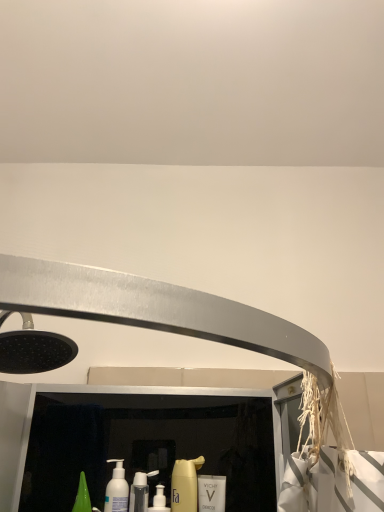
Image resolution: width=384 pixels, height=512 pixels. Describe the element at coordinates (211, 493) in the screenshot. I see `white glossy mouthwash at center, which is the second mouthwash in left-to-right order` at that location.

Find the location of `yellow matte bottle at center, which ranks as the first cleaning product in right-to-left order`. yellow matte bottle at center, which ranks as the first cleaning product in right-to-left order is located at coordinates (185, 484).

Where is `white matte bottle at lower left, the 1th mouthwash from the left`? white matte bottle at lower left, the 1th mouthwash from the left is located at coordinates (117, 489).

Find the location of a particular element. The height and width of the screenshot is (512, 384). white glossy bottle at center, positioned as the second cleaning product in right-to-left order is located at coordinates (140, 490).

Can you confirm if white glossy bottle at center, which is counted as the 1th cleaning product, starting from the left, is taller than white glossy mouthwash at center, which is the second mouthwash in left-to-right order?

No, white glossy bottle at center, which is counted as the 1th cleaning product, starting from the left, is not taller than white glossy mouthwash at center, which is the second mouthwash in left-to-right order.

From the image's perspective, is white glossy bottle at center, which is counted as the 1th cleaning product, starting from the left, positioned above or below white glossy mouthwash at center, which ranks as the 1th mouthwash in right-to-left order?

white glossy bottle at center, which is counted as the 1th cleaning product, starting from the left, is above white glossy mouthwash at center, which ranks as the 1th mouthwash in right-to-left order.

Between white glossy bottle at center, which is counted as the 1th cleaning product, starting from the left, and white glossy mouthwash at center, which ranks as the 1th mouthwash in right-to-left order, which one has larger size?

white glossy bottle at center, which is counted as the 1th cleaning product, starting from the left, is bigger.

Considering the relative sizes of yellow matte bottle at center, which ranks as the first cleaning product in right-to-left order, and white glossy bottle at center, which is counted as the 1th cleaning product, starting from the left, in the image provided, is yellow matte bottle at center, which ranks as the first cleaning product in right-to-left order, bigger than white glossy bottle at center, which is counted as the 1th cleaning product, starting from the left,?

Yes, yellow matte bottle at center, which ranks as the first cleaning product in right-to-left order, is bigger than white glossy bottle at center, which is counted as the 1th cleaning product, starting from the left.

Is yellow matte bottle at center, which ranks as the first cleaning product in right-to-left order, wider than white glossy bottle at center, which is counted as the 1th cleaning product, starting from the left?

In fact, yellow matte bottle at center, which ranks as the first cleaning product in right-to-left order, might be narrower than white glossy bottle at center, which is counted as the 1th cleaning product, starting from the left.

From the image's perspective, is yellow matte bottle at center, which ranks as the second cleaning product in left-to-right order, on white glossy bottle at center, positioned as the second cleaning product in right-to-left order?

Yes.

Consider the image. Do you think yellow matte bottle at center, which ranks as the second cleaning product in left-to-right order, is within white glossy bottle at center, which is counted as the 1th cleaning product, starting from the left, or outside of it?

yellow matte bottle at center, which ranks as the second cleaning product in left-to-right order, exists outside the volume of white glossy bottle at center, which is counted as the 1th cleaning product, starting from the left.

Is yellow matte bottle at center, which ranks as the second cleaning product in left-to-right order, positioned far away from white glossy mouthwash at center, which is the second mouthwash in left-to-right order?

No, yellow matte bottle at center, which ranks as the second cleaning product in left-to-right order, is not far from white glossy mouthwash at center, which is the second mouthwash in left-to-right order.

Does point (193, 488) appear closer or farther from the camera than point (215, 483)?

Point (193, 488) appears to be closer to the viewer than point (215, 483).

Is yellow matte bottle at center, which ranks as the second cleaning product in left-to-right order, spatially inside white glossy mouthwash at center, which ranks as the 1th mouthwash in right-to-left order, or outside of it?

yellow matte bottle at center, which ranks as the second cleaning product in left-to-right order, lies outside white glossy mouthwash at center, which ranks as the 1th mouthwash in right-to-left order.

Visually, is yellow matte bottle at center, which ranks as the second cleaning product in left-to-right order, positioned to the left or to the right of white glossy mouthwash at center, which is the second mouthwash in left-to-right order?

yellow matte bottle at center, which ranks as the second cleaning product in left-to-right order, is to the left of white glossy mouthwash at center, which is the second mouthwash in left-to-right order.

From a real-world perspective, is white glossy mouthwash at center, which is the second mouthwash in left-to-right order, on white glossy bottle at center, which is counted as the 1th cleaning product, starting from the left?

Yes, from a real-world perspective, white glossy mouthwash at center, which is the second mouthwash in left-to-right order, is above white glossy bottle at center, which is counted as the 1th cleaning product, starting from the left.

Can you confirm if white glossy mouthwash at center, which is the second mouthwash in left-to-right order, is bigger than white glossy bottle at center, which is counted as the 1th cleaning product, starting from the left?

Incorrect, white glossy mouthwash at center, which is the second mouthwash in left-to-right order, is not larger than white glossy bottle at center, which is counted as the 1th cleaning product, starting from the left.

Between point (218, 476) and point (139, 504), which one is positioned in front?

Point (139, 504)

Is white matte bottle at lower left, positioned as the second mouthwash in right-to-left order, not close to white glossy mouthwash at center, which is the second mouthwash in left-to-right order?

That's not correct — white matte bottle at lower left, positioned as the second mouthwash in right-to-left order, is a little close to white glossy mouthwash at center, which is the second mouthwash in left-to-right order.

Between white matte bottle at lower left, positioned as the second mouthwash in right-to-left order, and white glossy mouthwash at center, which ranks as the 1th mouthwash in right-to-left order, which one has smaller width?

white glossy mouthwash at center, which ranks as the 1th mouthwash in right-to-left order, is thinner.

Is white matte bottle at lower left, the 1th mouthwash from the left, situated inside white glossy mouthwash at center, which ranks as the 1th mouthwash in right-to-left order, or outside?

white matte bottle at lower left, the 1th mouthwash from the left, is outside white glossy mouthwash at center, which ranks as the 1th mouthwash in right-to-left order.

Can you confirm if white matte bottle at lower left, positioned as the second mouthwash in right-to-left order, is positioned to the left of white glossy mouthwash at center, which is the second mouthwash in left-to-right order?

Yes.

Considering the relative sizes of white glossy mouthwash at center, which is the second mouthwash in left-to-right order, and yellow matte bottle at center, which ranks as the first cleaning product in right-to-left order, in the image provided, is white glossy mouthwash at center, which is the second mouthwash in left-to-right order, taller than yellow matte bottle at center, which ranks as the first cleaning product in right-to-left order,?

No, white glossy mouthwash at center, which is the second mouthwash in left-to-right order, is not taller than yellow matte bottle at center, which ranks as the first cleaning product in right-to-left order.

Is white glossy mouthwash at center, which is the second mouthwash in left-to-right order, smaller than yellow matte bottle at center, which ranks as the second cleaning product in left-to-right order?

Correct, white glossy mouthwash at center, which is the second mouthwash in left-to-right order, occupies less space than yellow matte bottle at center, which ranks as the second cleaning product in left-to-right order.

Which of these two, white glossy mouthwash at center, which is the second mouthwash in left-to-right order, or yellow matte bottle at center, which ranks as the second cleaning product in left-to-right order, is wider?

With larger width is yellow matte bottle at center, which ranks as the second cleaning product in left-to-right order.

Is white glossy mouthwash at center, which ranks as the 1th mouthwash in right-to-left order, with yellow matte bottle at center, which ranks as the second cleaning product in left-to-right order?

Yes, white glossy mouthwash at center, which ranks as the 1th mouthwash in right-to-left order, is right next to yellow matte bottle at center, which ranks as the second cleaning product in left-to-right order, and making contact.

The image size is (384, 512). What are the coordinates of `the 2nd cleaning product below the white matte bottle at lower left, positioned as the second mouthwash in right-to-left order (from the image's perspective)` in the screenshot? It's located at (140, 490).

Is white glossy bottle at center, which is counted as the 1th cleaning product, starting from the left, wider than white matte bottle at lower left, positioned as the second mouthwash in right-to-left order?

Incorrect, the width of white glossy bottle at center, which is counted as the 1th cleaning product, starting from the left, does not surpass that of white matte bottle at lower left, positioned as the second mouthwash in right-to-left order.

Does white glossy bottle at center, which is counted as the 1th cleaning product, starting from the left, have a greater height compared to white matte bottle at lower left, positioned as the second mouthwash in right-to-left order?

No.

The height and width of the screenshot is (512, 384). I want to click on mouthwash on the right of the white glossy bottle at center, which is counted as the 1th cleaning product, starting from the left, so click(211, 493).

You are a GUI agent. You are given a task and a screenshot of the screen. Output one action in this format:
    pyautogui.click(x=<x>, y=<y>)
    Task: Click on the cleaning product that appears in front of the yellow matte bottle at center, which ranks as the second cleaning product in left-to-right order
    This screenshot has width=384, height=512.
    Given the screenshot: What is the action you would take?
    pyautogui.click(x=140, y=490)

Considering their positions, is white matte bottle at lower left, the 1th mouthwash from the left, positioned closer to white glossy bottle at center, positioned as the second cleaning product in right-to-left order, than white glossy mouthwash at center, which ranks as the 1th mouthwash in right-to-left order?

white matte bottle at lower left, the 1th mouthwash from the left, lies closer to white glossy bottle at center, positioned as the second cleaning product in right-to-left order, than the other object.

Based on their spatial positions, is white glossy bottle at center, which is counted as the 1th cleaning product, starting from the left, or white matte bottle at lower left, positioned as the second mouthwash in right-to-left order, closer to white glossy mouthwash at center, which is the second mouthwash in left-to-right order?

white glossy bottle at center, which is counted as the 1th cleaning product, starting from the left, is closer to white glossy mouthwash at center, which is the second mouthwash in left-to-right order.

Looking at the image, which one is located further to white glossy bottle at center, positioned as the second cleaning product in right-to-left order, yellow matte bottle at center, which ranks as the second cleaning product in left-to-right order, or white matte bottle at lower left, the 1th mouthwash from the left?

yellow matte bottle at center, which ranks as the second cleaning product in left-to-right order, lies further to white glossy bottle at center, positioned as the second cleaning product in right-to-left order, than the other object.

Which object lies nearer to the anchor point white glossy bottle at center, which is counted as the 1th cleaning product, starting from the left, white glossy mouthwash at center, which ranks as the 1th mouthwash in right-to-left order, or white matte bottle at lower left, positioned as the second mouthwash in right-to-left order?

Answer: Based on the image, white matte bottle at lower left, positioned as the second mouthwash in right-to-left order, appears to be nearer to white glossy bottle at center, which is counted as the 1th cleaning product, starting from the left.

When comparing their distances from white matte bottle at lower left, the 1th mouthwash from the left, does white glossy mouthwash at center, which is the second mouthwash in left-to-right order, or white glossy bottle at center, which is counted as the 1th cleaning product, starting from the left, seem further?

Among the two, white glossy mouthwash at center, which is the second mouthwash in left-to-right order, is located further to white matte bottle at lower left, the 1th mouthwash from the left.

Looking at the image, which one is located further to white glossy bottle at center, which is counted as the 1th cleaning product, starting from the left, yellow matte bottle at center, which ranks as the first cleaning product in right-to-left order, or white glossy mouthwash at center, which ranks as the 1th mouthwash in right-to-left order?

Among the two, white glossy mouthwash at center, which ranks as the 1th mouthwash in right-to-left order, is located further to white glossy bottle at center, which is counted as the 1th cleaning product, starting from the left.

Based on their spatial positions, is white glossy mouthwash at center, which is the second mouthwash in left-to-right order, or white glossy bottle at center, which is counted as the 1th cleaning product, starting from the left, further from yellow matte bottle at center, which ranks as the first cleaning product in right-to-left order?

The object further to yellow matte bottle at center, which ranks as the first cleaning product in right-to-left order, is white glossy bottle at center, which is counted as the 1th cleaning product, starting from the left.

Estimate the real-world distances between objects in this image. Which object is further from white glossy mouthwash at center, which is the second mouthwash in left-to-right order, yellow matte bottle at center, which ranks as the second cleaning product in left-to-right order, or white matte bottle at lower left, positioned as the second mouthwash in right-to-left order?

white matte bottle at lower left, positioned as the second mouthwash in right-to-left order, is positioned further to the anchor white glossy mouthwash at center, which is the second mouthwash in left-to-right order.

Where is `cleaning product between white matte bottle at lower left, the 1th mouthwash from the left, and yellow matte bottle at center, which ranks as the first cleaning product in right-to-left order`? This screenshot has height=512, width=384. cleaning product between white matte bottle at lower left, the 1th mouthwash from the left, and yellow matte bottle at center, which ranks as the first cleaning product in right-to-left order is located at coordinates (140, 490).

Image resolution: width=384 pixels, height=512 pixels. Identify the location of cleaning product between white glossy bottle at center, which is counted as the 1th cleaning product, starting from the left, and white glossy mouthwash at center, which ranks as the 1th mouthwash in right-to-left order. (185, 484).